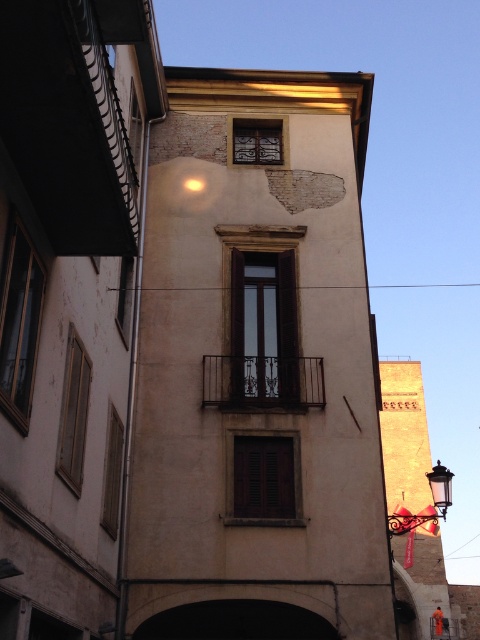
Question: Is polished brass lantern at lower right positioned in front of metallic glass lantern at lower right?

Choices:
 (A) yes
 (B) no

Answer: (A)

Question: Can you confirm if polished brass lantern at lower right is thinner than metallic glass lantern at lower right?

Choices:
 (A) yes
 (B) no

Answer: (B)

Question: Which object is farther from the camera taking this photo?

Choices:
 (A) metallic glass lantern at lower right
 (B) polished brass lantern at lower right

Answer: (A)

Question: Which point appears closest to the camera in this image?

Choices:
 (A) (435, 474)
 (B) (444, 483)

Answer: (B)

Question: Does polished brass lantern at lower right have a lesser width compared to metallic glass lantern at lower right?

Choices:
 (A) yes
 (B) no

Answer: (B)